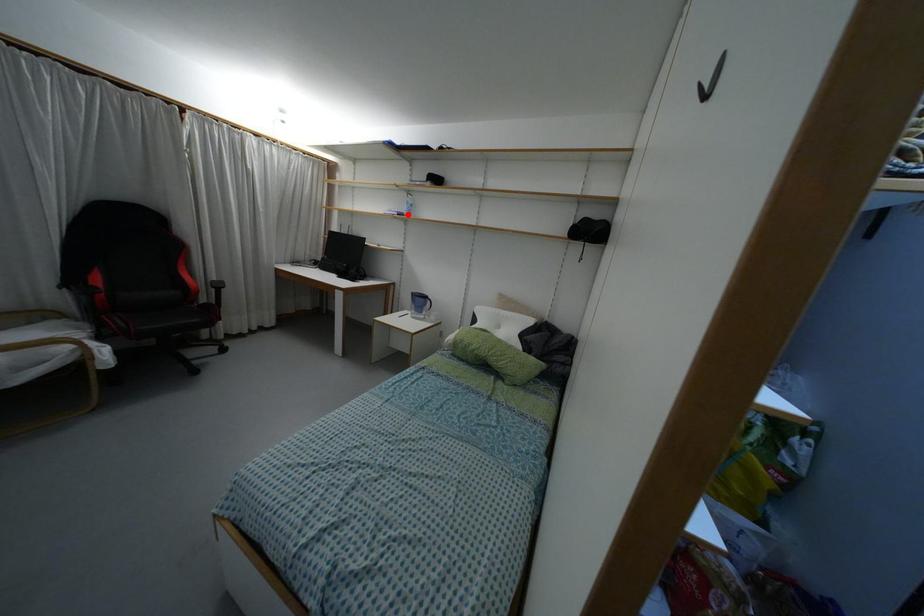
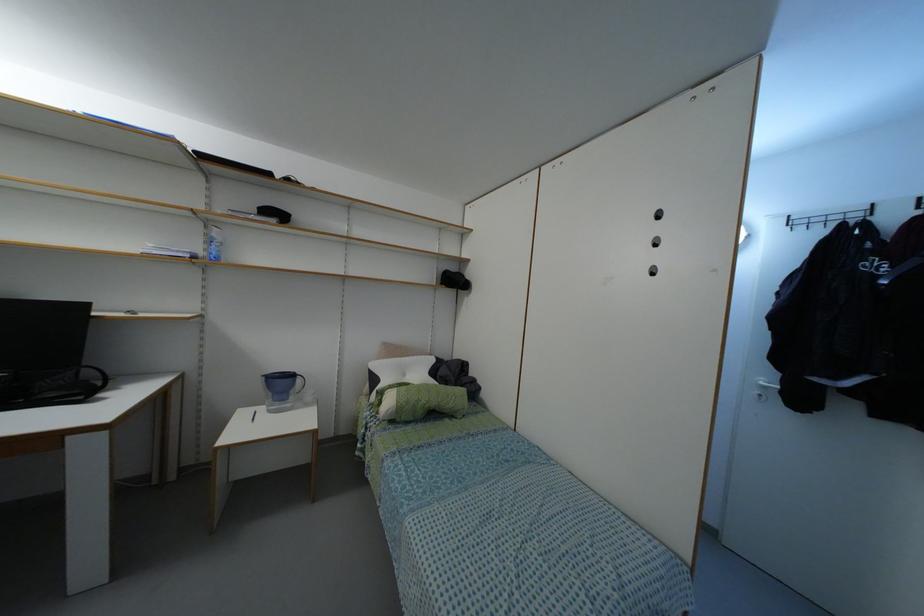
In the second image, find the point that corresponds to the highlighted location in the first image.

(216, 257)